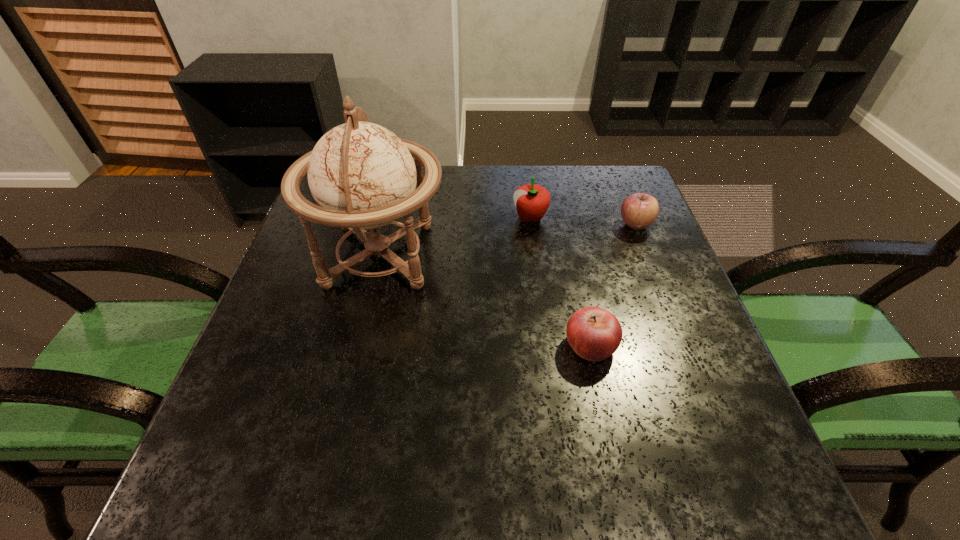
Locate an element on the screen. the leftmost object is located at coordinates (362, 176).

Identify the location of globe. This screenshot has width=960, height=540. (362, 176).

Image resolution: width=960 pixels, height=540 pixels. Identify the location of the rightmost apple. (639, 210).

The height and width of the screenshot is (540, 960). Find the location of `the nearest object`. the nearest object is located at coordinates (594, 334).

You are a GUI agent. You are given a task and a screenshot of the screen. Output one action in this format:
    pyautogui.click(x=<x>, y=<y>)
    Task: Click on the vacant area located 0.070m on the front-facing side of the leftmost object
    This screenshot has width=960, height=540.
    Given the screenshot: What is the action you would take?
    pyautogui.click(x=476, y=255)

The image size is (960, 540). I want to click on vacant space located on the front of the rightmost object, so click(x=652, y=266).

The width and height of the screenshot is (960, 540). I want to click on free space located 0.170m on the right of the nearest apple, so click(x=704, y=346).

Where is `object at the far edge`? Image resolution: width=960 pixels, height=540 pixels. object at the far edge is located at coordinates (532, 201).

Locate an element on the screen. object at the left edge is located at coordinates (362, 176).

You are a GUI agent. You are given a task and a screenshot of the screen. Output one action in this format:
    pyautogui.click(x=<x>, y=<y>)
    Task: Click on the object located in the right edge section of the desktop
    The height and width of the screenshot is (540, 960).
    Given the screenshot: What is the action you would take?
    pyautogui.click(x=639, y=210)